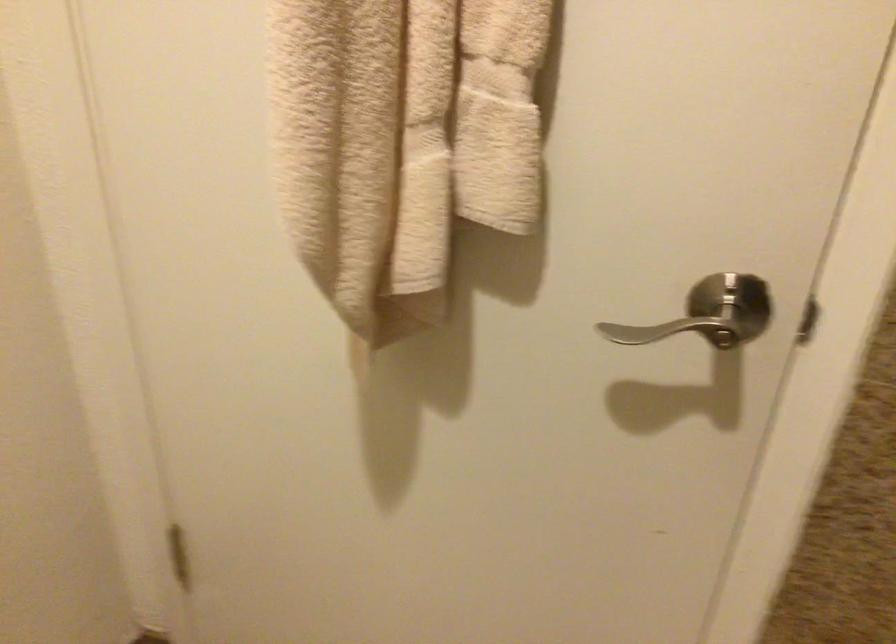
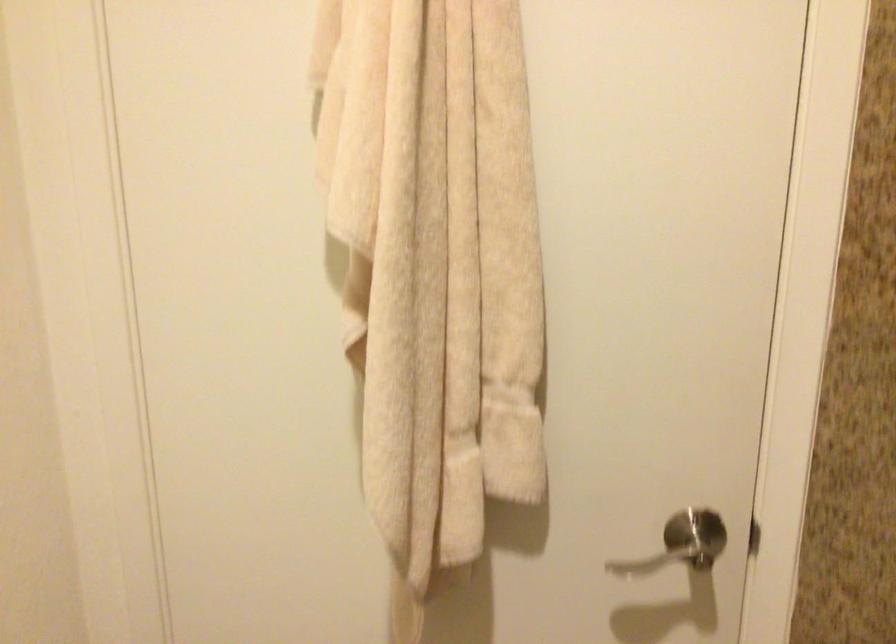
Question: How did the camera likely rotate?

Choices:
 (A) Left
 (B) Right
 (C) Up
 (D) Down

Answer: (C)